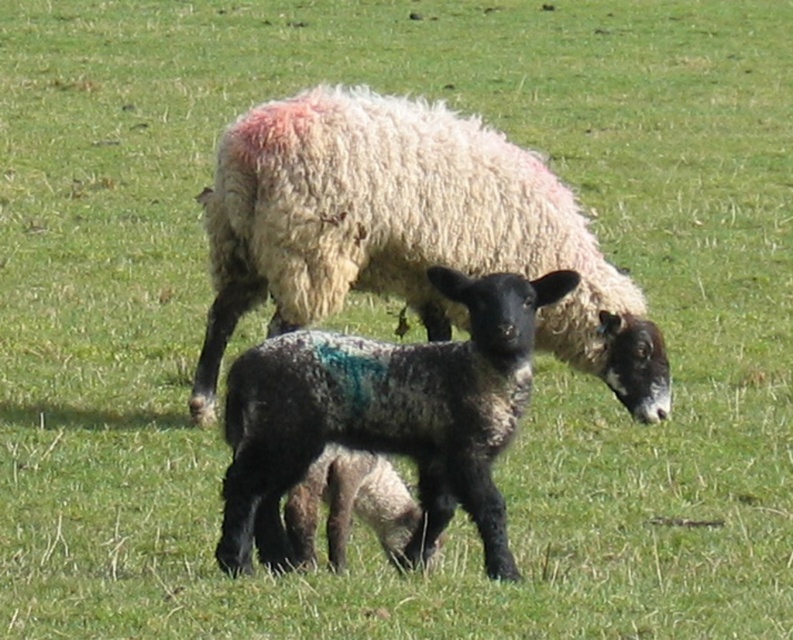
Question: Can you confirm if white woolen sheep at center is thinner than speckled wool lamb at center?

Choices:
 (A) no
 (B) yes

Answer: (A)

Question: In this image, where is white woolen sheep at center located relative to speckled wool lamb at center?

Choices:
 (A) left
 (B) right

Answer: (A)

Question: Observing the image, what is the correct spatial positioning of white woolen sheep at center in reference to speckled wool lamb at center?

Choices:
 (A) below
 (B) above

Answer: (B)

Question: Which object appears closest to the camera in this image?

Choices:
 (A) white woolen sheep at center
 (B) speckled wool lamb at center

Answer: (B)

Question: Among these points, which one is farthest from the camera?

Choices:
 (A) (267, 157)
 (B) (320, 451)

Answer: (A)